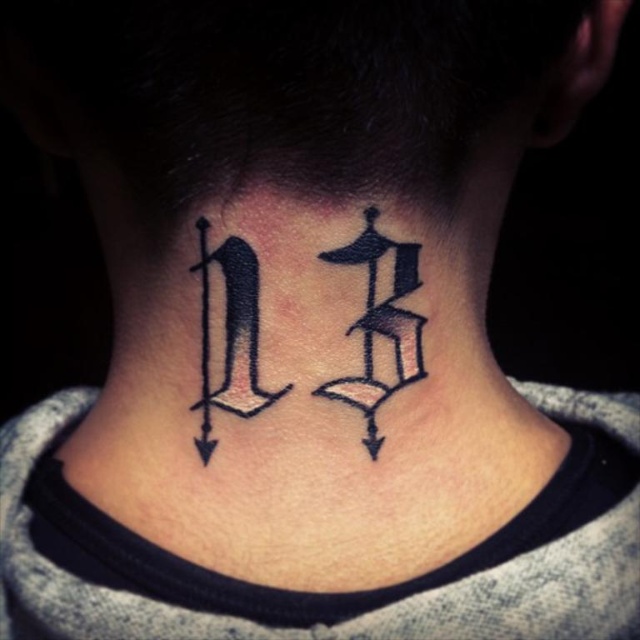
Question: Can you confirm if black ink letter at center is positioned above black ink letter d at center?

Choices:
 (A) no
 (B) yes

Answer: (B)

Question: Which point appears closest to the camera in this image?

Choices:
 (A) (208, 432)
 (B) (368, 342)
 (C) (372, 397)

Answer: (B)

Question: Where is black ink tattoo at center located in relation to black ink letter at center in the image?

Choices:
 (A) below
 (B) above

Answer: (A)

Question: Which point is closer to the camera taking this photo?

Choices:
 (A) (419, 333)
 (B) (384, 394)
 (C) (225, 352)

Answer: (C)

Question: Does black ink tattoo at center appear over black ink letter d at center?

Choices:
 (A) yes
 (B) no

Answer: (A)

Question: Which of these objects is positioned farthest from the black ink tattoo at center?

Choices:
 (A) black ink letter at center
 (B) black ink letter d at center

Answer: (B)